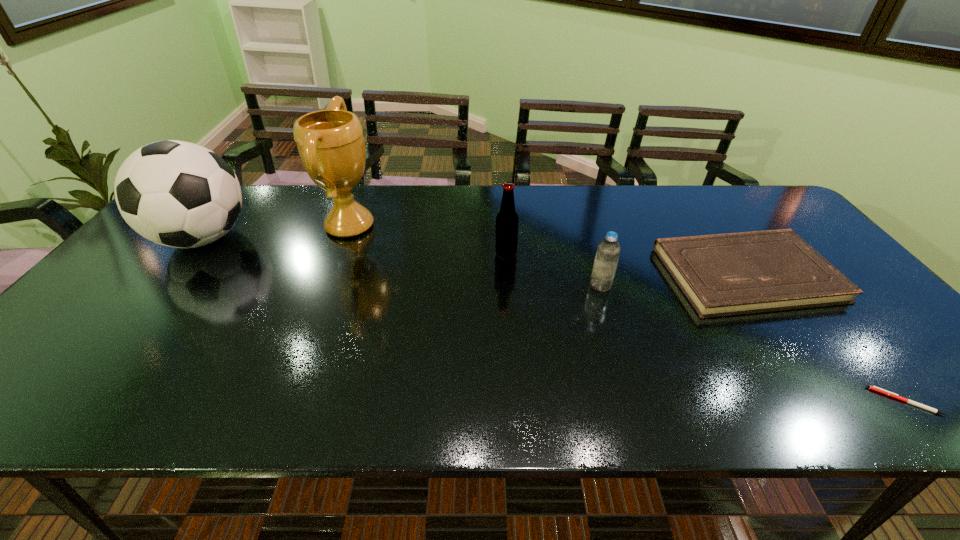
I want to click on object that is the closest to the nearest object, so click(727, 274).

This screenshot has height=540, width=960. Find the location of `object that is the closest to the nearest object`. object that is the closest to the nearest object is located at coordinates (727, 274).

At what (x,y) coordinates should I click in order to perform the action: click on vacant point that satisfies the following two spatial constraints: 1. on the back side of the third object from left to right; 2. on the front of the tallest object with the decoration. Please return your answer as a coordinate pair (x, y). Image resolution: width=960 pixels, height=540 pixels. Looking at the image, I should click on (504, 226).

The height and width of the screenshot is (540, 960). I want to click on free space that satisfies the following two spatial constraints: 1. on the front of the paperback book with the decoration; 2. on the left side of the fifth object from right to left, so click(330, 274).

You are a GUI agent. You are given a task and a screenshot of the screen. Output one action in this format:
    pyautogui.click(x=<x>, y=<y>)
    Task: Click on the vacant space that satisfies the following two spatial constraints: 1. on the front side of the third shortest object; 2. on the left side of the beer bottle
    The image size is (960, 540).
    Given the screenshot: What is the action you would take?
    pyautogui.click(x=508, y=285)